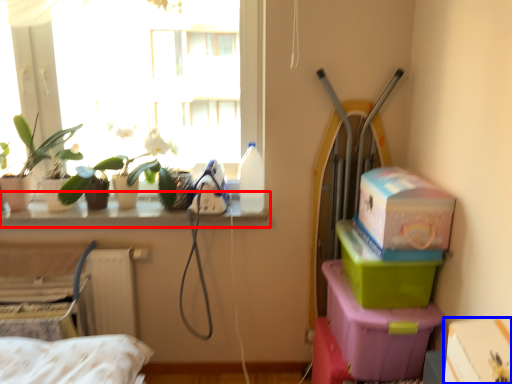
Question: Which point is further to the camera, window sill (highlighted by a red box) or box (highlighted by a blue box)?

Choices:
 (A) window sill
 (B) box

Answer: (A)